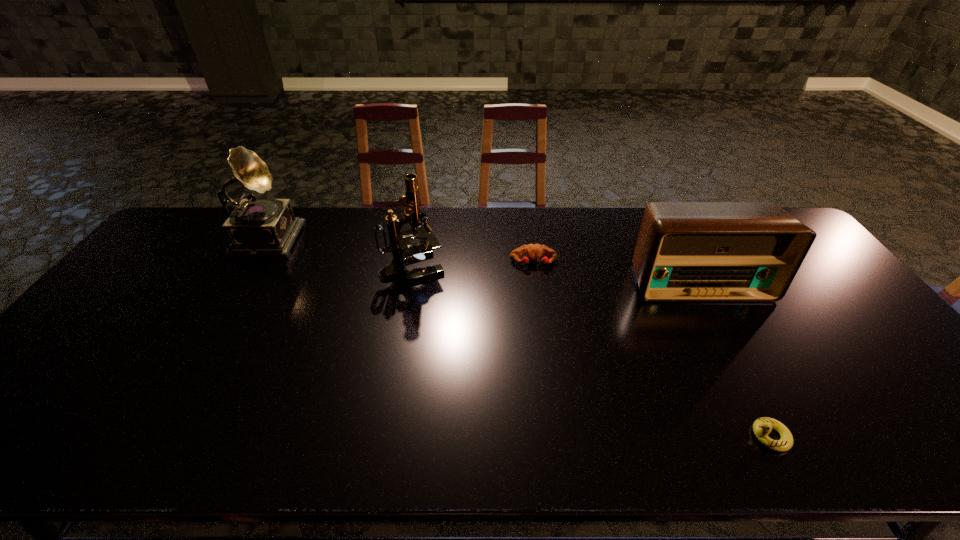
I want to click on the leftmost object, so click(x=256, y=227).

You are a GUI agent. You are given a task and a screenshot of the screen. Output one action in this format:
    pyautogui.click(x=<x>, y=<y>)
    Task: Click on the microscope
    The image size is (960, 540).
    Given the screenshot: What is the action you would take?
    pyautogui.click(x=403, y=250)

This screenshot has width=960, height=540. I want to click on the third shortest object, so click(x=686, y=251).

Locate an element on the screen. the third object from left to right is located at coordinates (533, 251).

This screenshot has width=960, height=540. I want to click on duckling, so click(x=762, y=427).

This screenshot has width=960, height=540. Find the location of `vacant space situated 0.090m on the horn of the record player`. vacant space situated 0.090m on the horn of the record player is located at coordinates (326, 235).

The image size is (960, 540). Identify the location of free space located at the eyepiece of the fourth object from right to left. (574, 266).

What are the coordinates of `vacant space located on the front-facing side of the third tallest object` in the screenshot? It's located at (720, 319).

Identify the location of vacant space situated 0.340m with the gloves of the puncher facing forward. The height and width of the screenshot is (540, 960). (547, 359).

Find the location of a particular element. Image resolution: width=960 pixels, height=540 pixels. free spot located on the face of the nearest object is located at coordinates (671, 436).